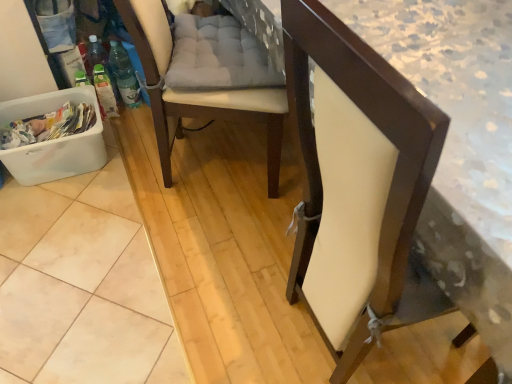
Where is `free location in front of white plastic laundry basket at lower left`? This screenshot has height=384, width=512. free location in front of white plastic laundry basket at lower left is located at coordinates (59, 223).